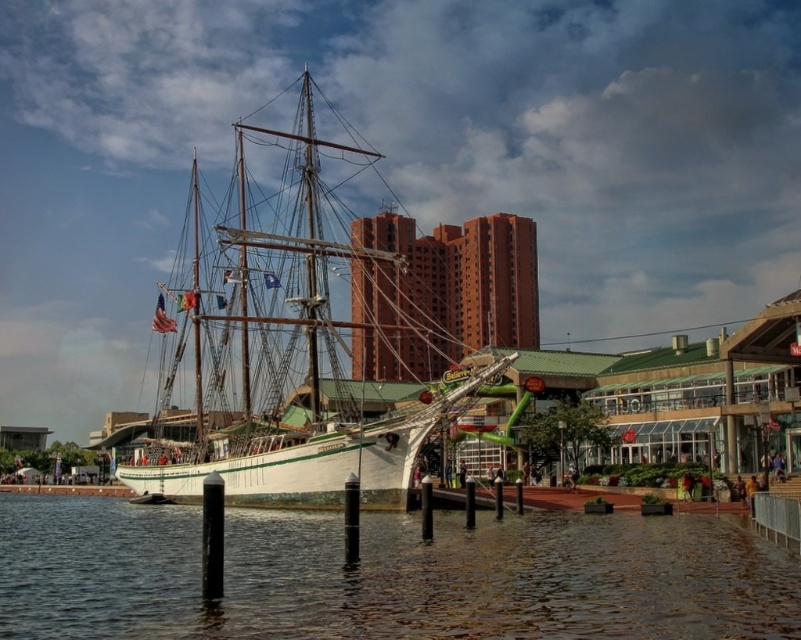
You are a photographer planning to capture the waterfront scene. You want to ensure both the clear water at lower left and the white matte ship at center are visible in your shot. Given their sizes, which object should you prioritize framing closer to avoid cropping?

The clear water at lower left is smaller than the white matte ship at center, so you should prioritize framing the white matte ship at center closer to avoid cropping since it is larger and requires more space in the composition.

You are a photographer standing at the waterfront. You want to capture a photo where the white matte ship at center is taller than the clear water at lower left. Is this possible based on the scene?

Yes, the clear water at lower left is shorter than the white matte ship at center, so the ship will appear taller in the photo.

You are standing on the pier and want to take a photo of the white matte ship at center. To avoid including the clear water at lower left in your photo, where should you position yourself relative to the ship?

You should position yourself above the white matte ship at center because the clear water at lower left is located below it. This way, angling the camera downward towards the ship will exclude the water area beneath.